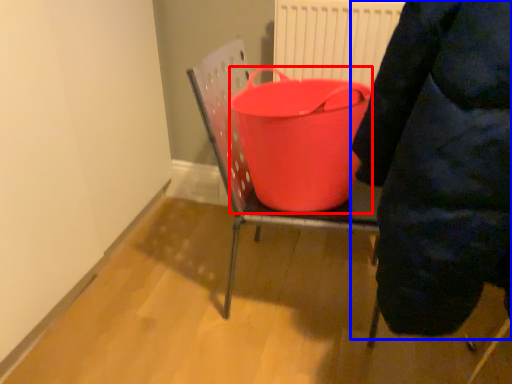
Question: Which object is closer to the camera taking this photo, basin (highlighted by a red box) or person (highlighted by a blue box)?

Choices:
 (A) basin
 (B) person

Answer: (B)